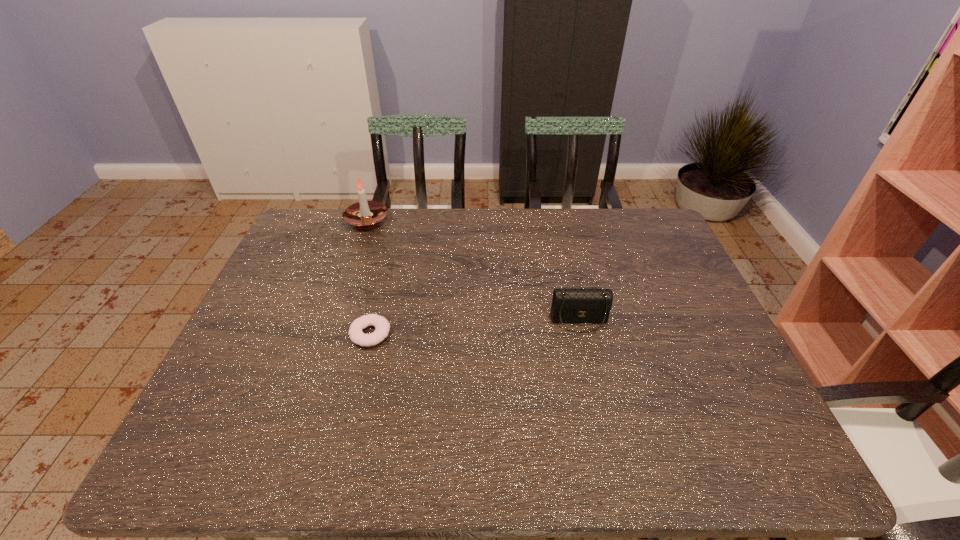
I want to click on the tallest object, so click(364, 214).

Locate an element on the screen. The height and width of the screenshot is (540, 960). candle is located at coordinates tap(364, 214).

What are the coordinates of `the second tallest object` in the screenshot? It's located at (570, 305).

I want to click on clutch bag, so click(x=570, y=305).

This screenshot has height=540, width=960. What are the coordinates of `doughnut` in the screenshot? It's located at (381, 324).

The image size is (960, 540). Find the location of `free space located 0.300m on the right of the farthest object`. free space located 0.300m on the right of the farthest object is located at coordinates (475, 220).

The image size is (960, 540). In order to click on vacant space located on the front flap of the second tallest object in this screenshot , I will do `click(609, 450)`.

Locate an element on the screen. The height and width of the screenshot is (540, 960). vacant area situated on the front of the doughnut is located at coordinates (341, 457).

Where is `object that is at the far edge`? This screenshot has height=540, width=960. object that is at the far edge is located at coordinates (364, 214).

Image resolution: width=960 pixels, height=540 pixels. I want to click on object at the left edge, so click(x=364, y=214).